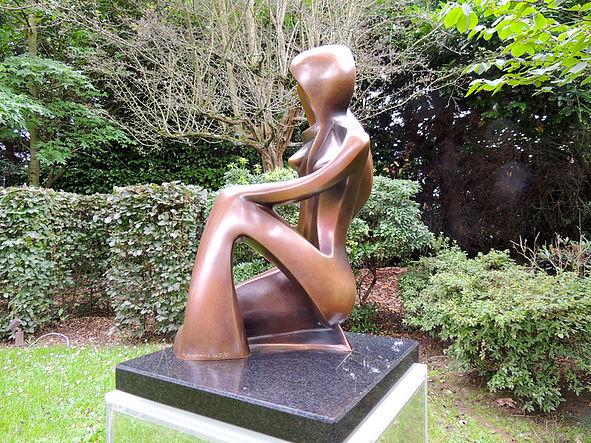
Where is `gold sculpture`? gold sculpture is located at coordinates (308, 81).